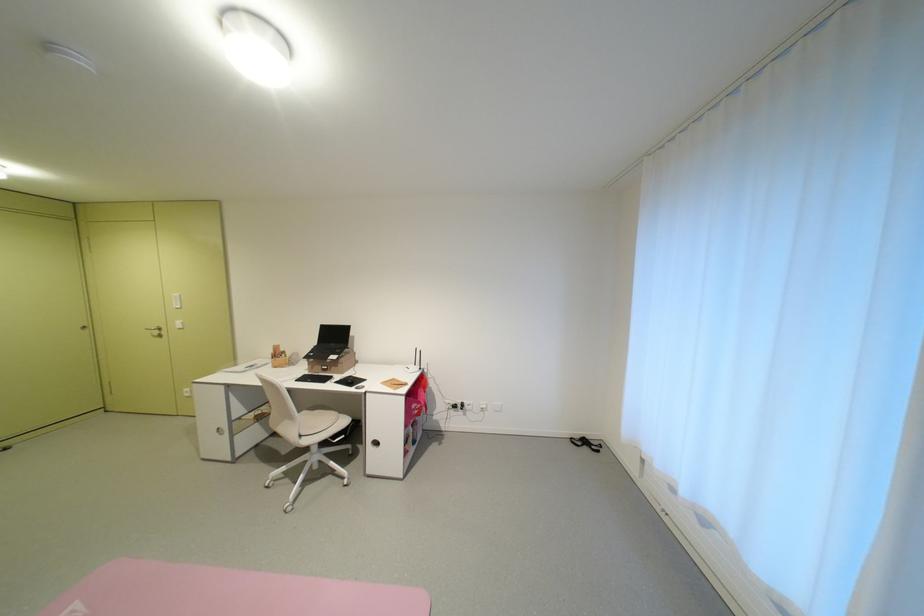
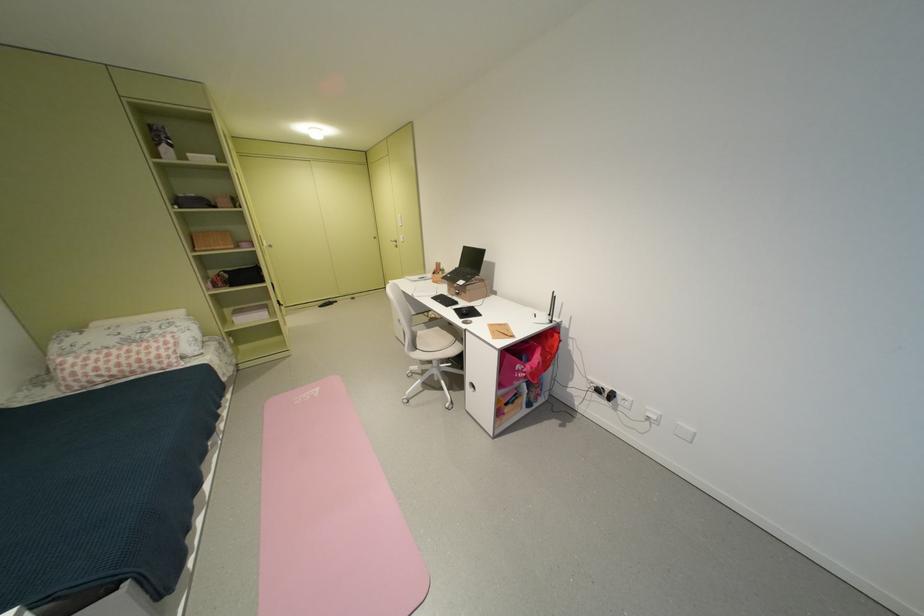
Find the pixel in the second image that matches [293,357] in the first image.

(450, 274)